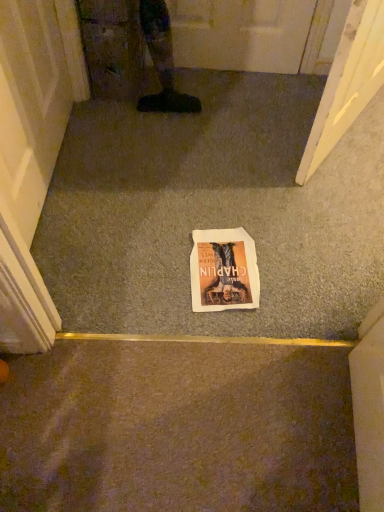
Find the location of a particular element. The height and width of the screenshot is (512, 384). free spot to the right of white paper comic book at center is located at coordinates (291, 268).